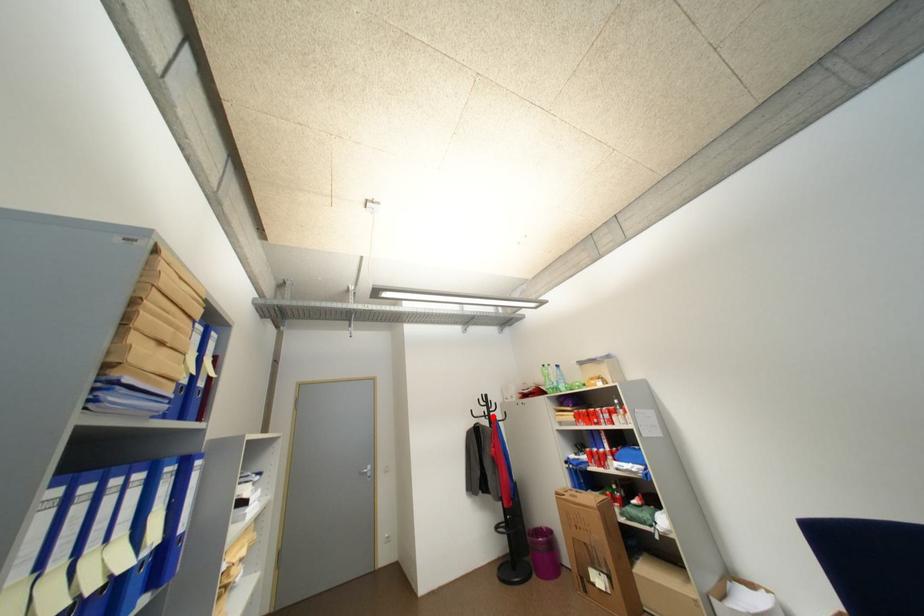
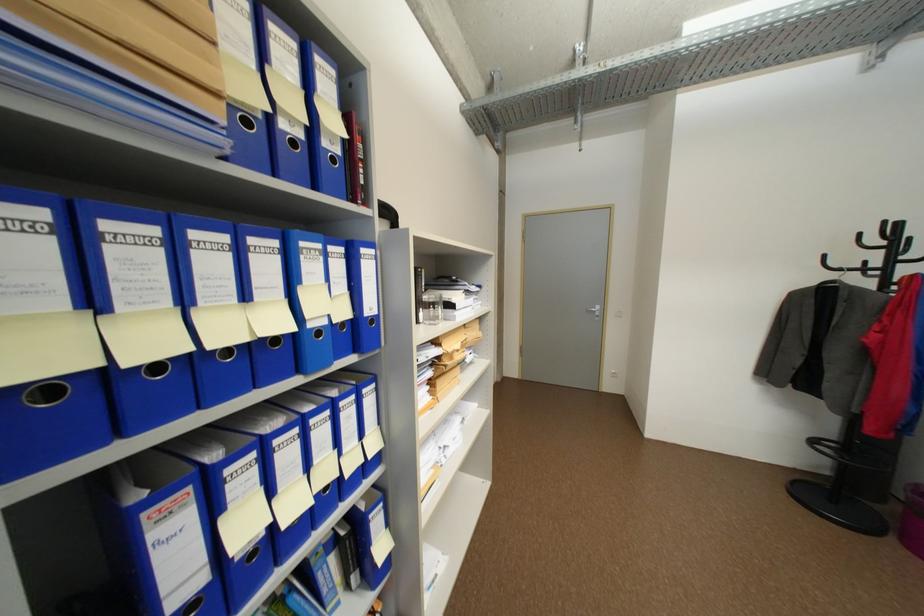
Locate, in the second image, the point that corresponds to the highlighted location in the first image.

(873, 270)